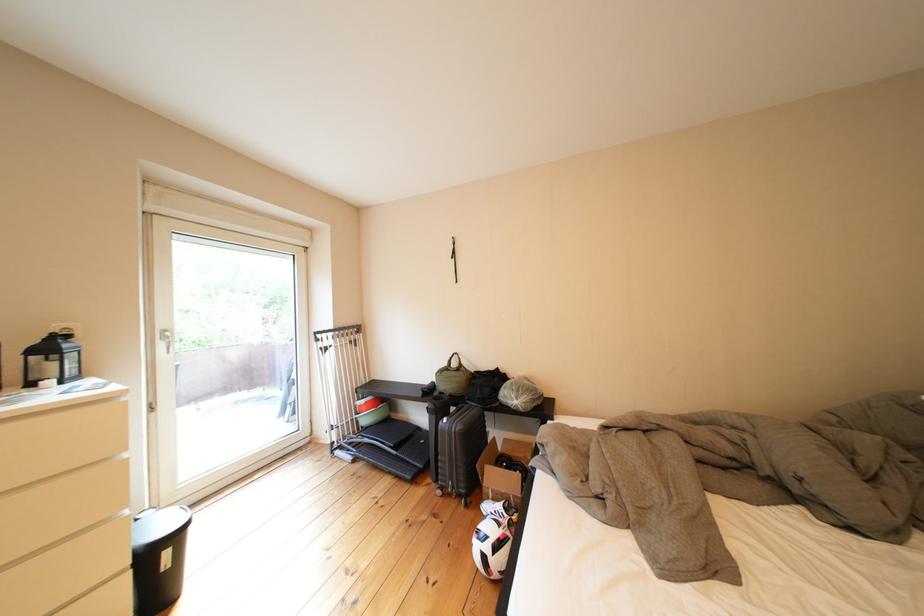
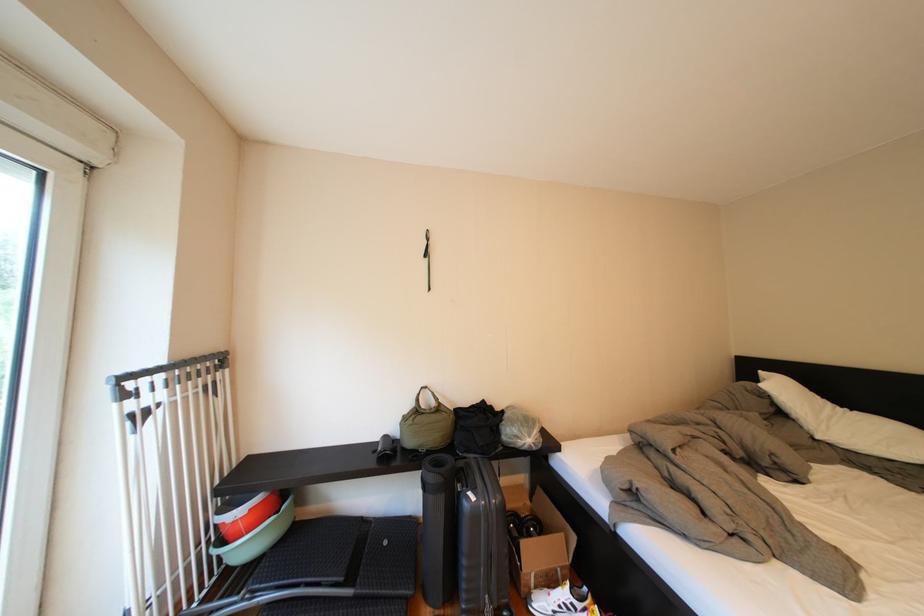
The point at (464, 366) is marked in the first image. Where is the corresponding point in the second image?

(431, 405)